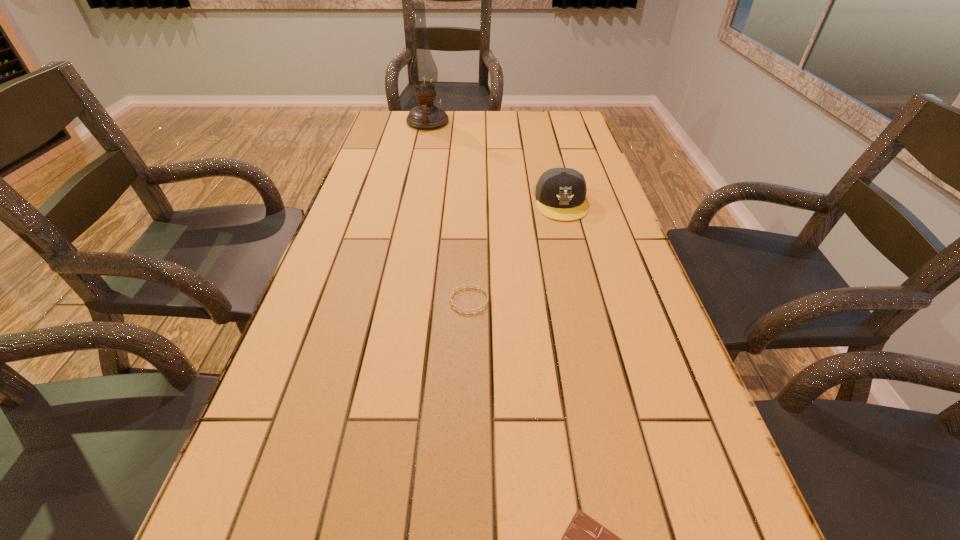
Find the location of a particular element. This screenshot has width=960, height=540. object at the left edge is located at coordinates (423, 71).

At what (x,y) coordinates should I click in order to perform the action: click on object that is positioned at the right edge. Please return your answer as a coordinate pair (x, y). The image size is (960, 540). Looking at the image, I should click on coord(560,192).

Image resolution: width=960 pixels, height=540 pixels. I want to click on object located in the far left corner section of the desktop, so click(423, 71).

This screenshot has height=540, width=960. In the image, there is a desktop. What are the coordinates of `vacant region at the left edge` in the screenshot? It's located at (386, 191).

In the image, there is a desktop. Find the location of `vacant space at the right edge`. vacant space at the right edge is located at coordinates (678, 350).

Where is `free space at the far left corner of the desktop`? The height and width of the screenshot is (540, 960). free space at the far left corner of the desktop is located at coordinates (405, 132).

Identify the location of vacant area that lies between the cap and the tallest object. (494, 163).

Identify the location of free space between the tallest object and the third nearest object. (494, 163).

Locate an element on the screen. unoccupied position between the second object from left to right and the oil lamp is located at coordinates (448, 212).

Find the location of a particular element. free space that is in between the second shortest object and the second farthest object is located at coordinates (516, 252).